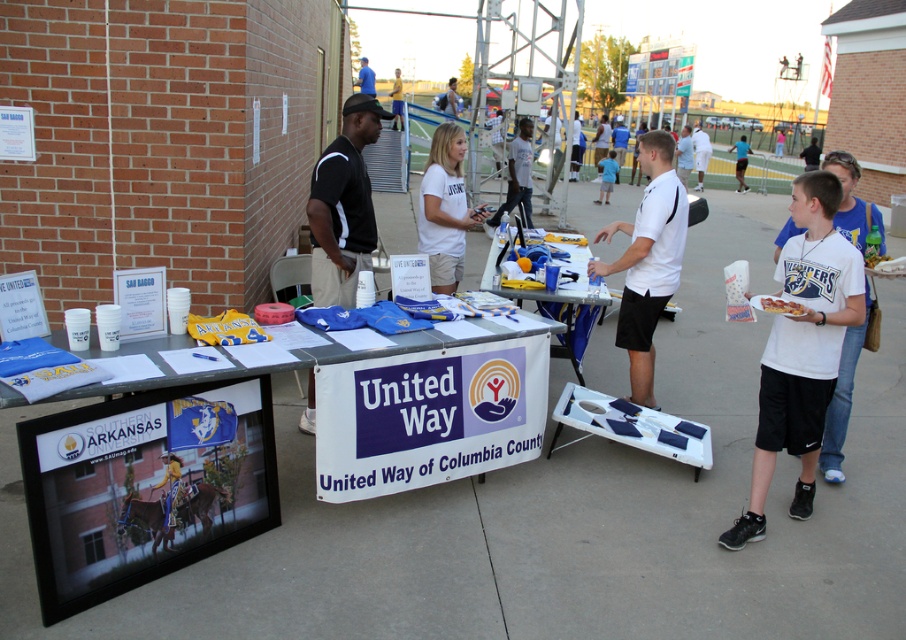
You are organizing a charity event and need to hand out shirts to volunteers. You see a white cotton shirt at center and a blue fabric shirt at upper center. Which shirt is located lower on the table?

The white cotton shirt at center is positioned under the blue fabric shirt at upper center, so the white cotton shirt at center is lower on the table.